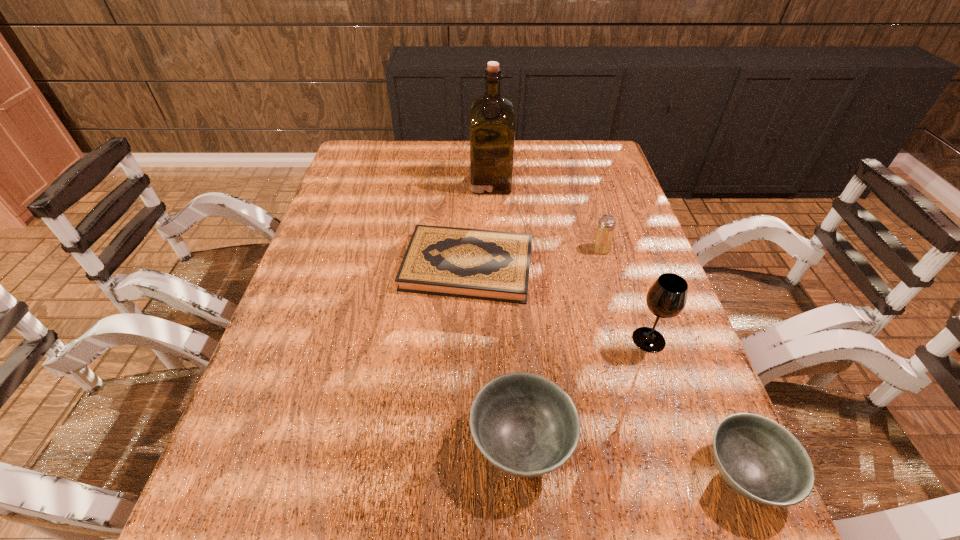
Choose which object is the fifth nearest neighbor to the right bowl. Please provide its 2D coordinates. Your answer should be formatted as a tuple, i.e. [(x, y)], where the tuple contains the x and y coordinates of a point satisfying the conditions above.

[(492, 117)]

Find the location of a particular element. The image size is (960, 540). free space in the image that satisfies the following two spatial constraints: 1. on the label of the farthest object; 2. on the back side of the saltshaker is located at coordinates (492, 249).

Locate an element on the screen. The height and width of the screenshot is (540, 960). vacant space that satisfies the following two spatial constraints: 1. on the front side of the left bowl; 2. on the left side of the fifth tallest object is located at coordinates (523, 473).

Find the location of `vacant space that satisfies the following two spatial constraints: 1. on the front side of the shortest object; 2. on the left side of the wineglass`. vacant space that satisfies the following two spatial constraints: 1. on the front side of the shortest object; 2. on the left side of the wineglass is located at coordinates (466, 340).

Image resolution: width=960 pixels, height=540 pixels. I want to click on vacant area that satisfies the following two spatial constraints: 1. on the label of the farthest object; 2. on the right side of the wineglass, so click(x=495, y=340).

Locate an element on the screen. The width and height of the screenshot is (960, 540). free space that satisfies the following two spatial constraints: 1. on the label of the tallest object; 2. on the left side of the shorter bowl is located at coordinates (499, 473).

Where is `free space that satisfies the following two spatial constraints: 1. on the back side of the taller bowl; 2. on the label of the tallest object`? The height and width of the screenshot is (540, 960). free space that satisfies the following two spatial constraints: 1. on the back side of the taller bowl; 2. on the label of the tallest object is located at coordinates (504, 183).

Locate an element on the screen. vacant space that satisfies the following two spatial constraints: 1. on the label of the second shortest object; 2. on the left side of the liquor is located at coordinates (499, 473).